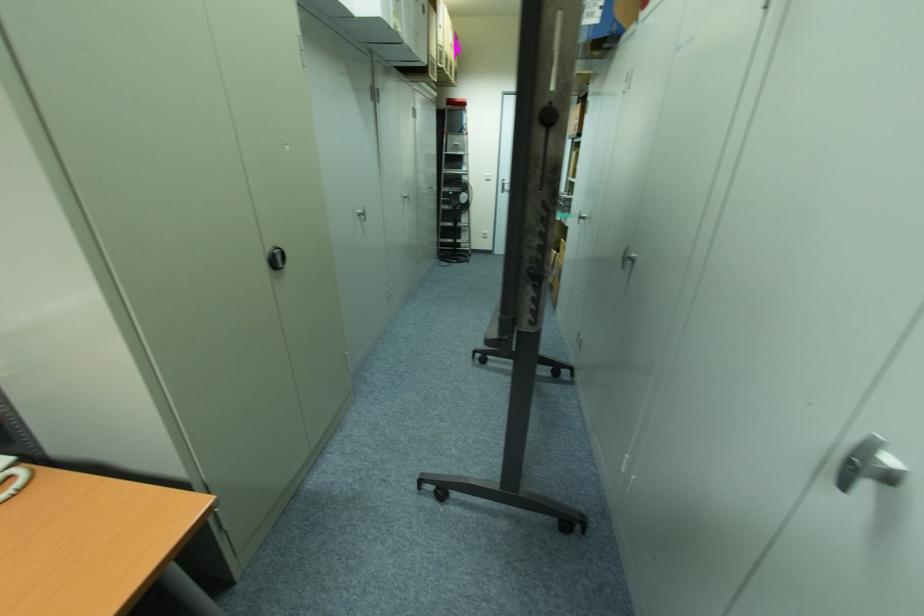
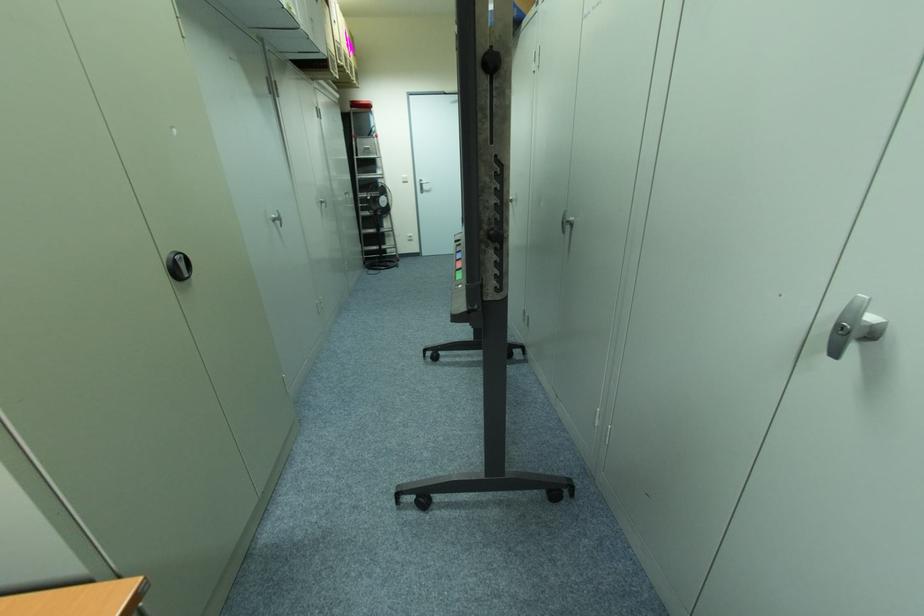
The point at (407,198) is marked in the first image. Where is the corresponding point in the second image?

(322, 203)